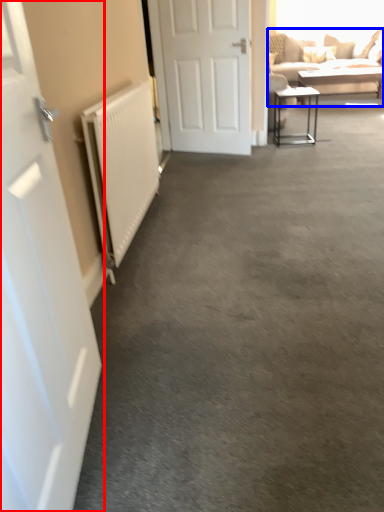
Question: Which object is further to the camera taking this photo, door (highlighted by a red box) or studio couch (highlighted by a blue box)?

Choices:
 (A) door
 (B) studio couch

Answer: (B)